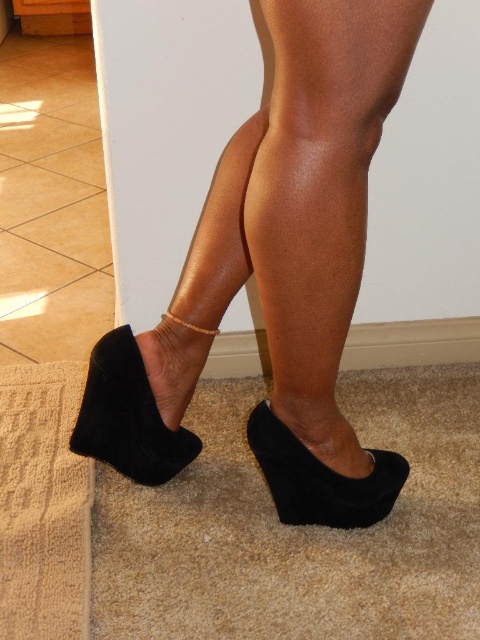
You are a photographer adjusting your camera to focus on two specific points in the image. The first point is point (95, 417) and the second is point (262, 465). Which point is closer to the camera?

Point (95, 417) is closer to the camera than point (262, 465) because it is further to the viewer.

You are a photographer setting up a shoot in the room. You want to position a small prop between the suede wedge shoe at lower left and the suede wedge at center. Based on their positions, will the prop be visible to someone standing directly in front of the two wedges?

The suede wedge at center is behind the suede wedge shoe at lower left, so placing a prop between them would position it behind the front wedge. Therefore, the prop might be partially or fully obscured from someone standing directly in front of the wedges.

You are a shoe designer trying to create a new pair of wedges. You want to ensure that the distance between the two wedges in the image is at least 10 inches to allow for proper airflow between them. Based on the information provided, will the current spacing between the suede black wedge at center and the matte black wedge at lower left meet your requirement?

The suede black wedge at center and the matte black wedge at lower left are 8.68 inches apart, which is less than the required 10 inches. Therefore, the current spacing does not meet the requirement for proper airflow between them.